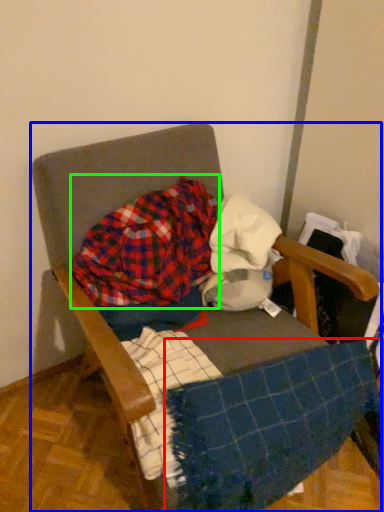
Question: Estimate the real-world distances between objects in this image. Which object is farther from blanket (highlighted by a red box), chair (highlighted by a blue box) or flannel (highlighted by a green box)?

Choices:
 (A) chair
 (B) flannel

Answer: (B)